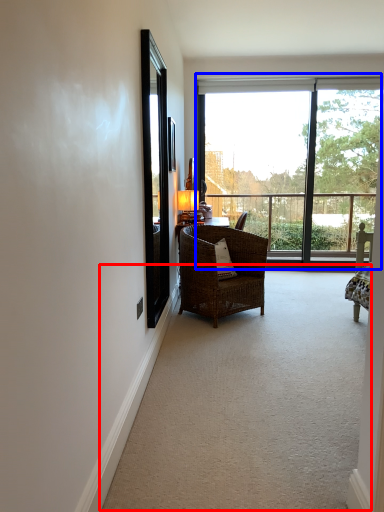
Question: Which of the following is the closest to the observer, corridor (highlighted by a red box) or window (highlighted by a blue box)?

Choices:
 (A) corridor
 (B) window

Answer: (A)